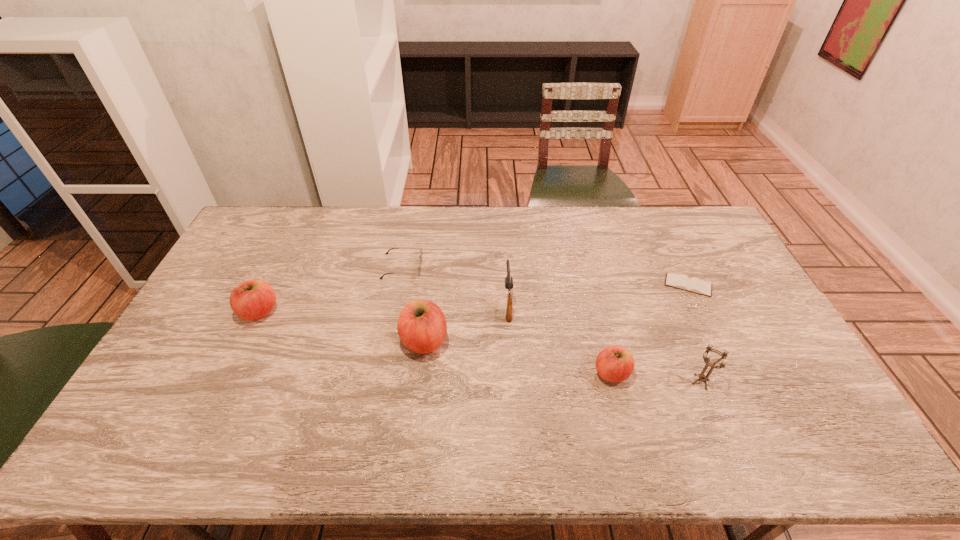
This screenshot has width=960, height=540. In order to click on vacant region located 0.090m on the back of the tallest apple in this screenshot , I will do [429, 300].

Locate an element on the screen. This screenshot has height=540, width=960. vacant region located 0.140m on the back of the shortest apple is located at coordinates (598, 321).

Where is `free location located 0.350m on the front-facing side of the sunglasses`? free location located 0.350m on the front-facing side of the sunglasses is located at coordinates (523, 266).

I want to click on vacant space located 0.230m on the left of the shortest object, so click(x=594, y=285).

You are a GUI agent. You are given a task and a screenshot of the screen. Output one action in this format:
    pyautogui.click(x=<x>, y=<y>)
    Task: Click on the free space located along the barrel of the gun
    Image resolution: width=960 pixels, height=540 pixels.
    Given the screenshot: What is the action you would take?
    pyautogui.click(x=506, y=268)

Where is `free location located along the barrel of the gun`? The width and height of the screenshot is (960, 540). free location located along the barrel of the gun is located at coordinates [x=503, y=232].

The height and width of the screenshot is (540, 960). I want to click on free space located along the barrel of the gun, so click(505, 253).

Identify the location of vacant area situated on the left of the candle holder. This screenshot has width=960, height=540. (599, 382).

Find the location of a particular element. The width and height of the screenshot is (960, 540). apple at the near edge is located at coordinates [615, 364].

The width and height of the screenshot is (960, 540). What are the coordinates of `candle holder at the near edge` in the screenshot? It's located at (702, 377).